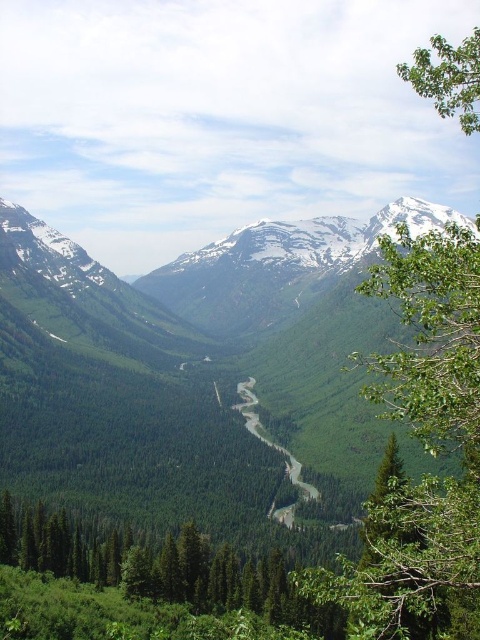
Question: Does green leafy tree at right lie behind green leafy tree at upper right?

Choices:
 (A) yes
 (B) no

Answer: (B)

Question: Which of the following is the farthest from the observer?

Choices:
 (A) (442, 486)
 (B) (447, 108)

Answer: (A)

Question: Can you confirm if green leafy tree at right is positioned below green leafy tree at upper right?

Choices:
 (A) no
 (B) yes

Answer: (B)

Question: Among these points, which one is farthest from the camera?

Choices:
 (A) (463, 240)
 (B) (475, 70)

Answer: (A)

Question: In this image, where is green leafy tree at right located relative to green leafy tree at upper right?

Choices:
 (A) above
 (B) below

Answer: (B)

Question: Which object appears closest to the camera in this image?

Choices:
 (A) green leafy tree at right
 (B) green leafy tree at upper right

Answer: (A)